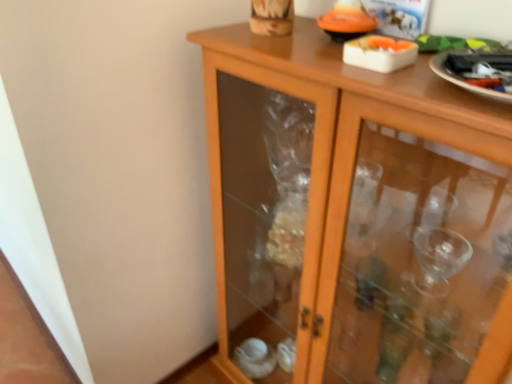
Question: Should I look upward or downward to see white glossy plate at upper right?

Choices:
 (A) up
 (B) down

Answer: (A)

Question: Can you confirm if wooden cabinet at center is taller than white glossy plate at upper right?

Choices:
 (A) yes
 (B) no

Answer: (A)

Question: Does wooden cabinet at center lie in front of white glossy plate at upper right?

Choices:
 (A) yes
 (B) no

Answer: (A)

Question: Could you tell me if wooden cabinet at center is facing white glossy plate at upper right?

Choices:
 (A) yes
 (B) no

Answer: (B)

Question: From a real-world perspective, is wooden cabinet at center on white glossy plate at upper right?

Choices:
 (A) no
 (B) yes

Answer: (A)

Question: Is white glossy plate at upper right completely or partially inside wooden cabinet at center?

Choices:
 (A) yes
 (B) no

Answer: (B)

Question: Does wooden cabinet at center have a larger size compared to white glossy plate at upper right?

Choices:
 (A) no
 (B) yes

Answer: (B)

Question: Is wooden cabinet at center located within white glossy plate at upper right?

Choices:
 (A) yes
 (B) no

Answer: (B)

Question: Is white glossy plate at upper right to the right of wooden cabinet at center from the viewer's perspective?

Choices:
 (A) yes
 (B) no

Answer: (A)

Question: Considering the relative sizes of white glossy plate at upper right and wooden cabinet at center in the image provided, is white glossy plate at upper right taller than wooden cabinet at center?

Choices:
 (A) no
 (B) yes

Answer: (A)

Question: Does white glossy plate at upper right have a lesser height compared to wooden cabinet at center?

Choices:
 (A) no
 (B) yes

Answer: (B)

Question: Could you tell me if white glossy plate at upper right is turned towards wooden cabinet at center?

Choices:
 (A) yes
 (B) no

Answer: (B)

Question: Is the depth of white glossy plate at upper right greater than that of wooden cabinet at center?

Choices:
 (A) no
 (B) yes

Answer: (B)

Question: Looking at the image, does white glossy plate at upper right seem bigger or smaller compared to wooden cabinet at center?

Choices:
 (A) small
 (B) big

Answer: (A)